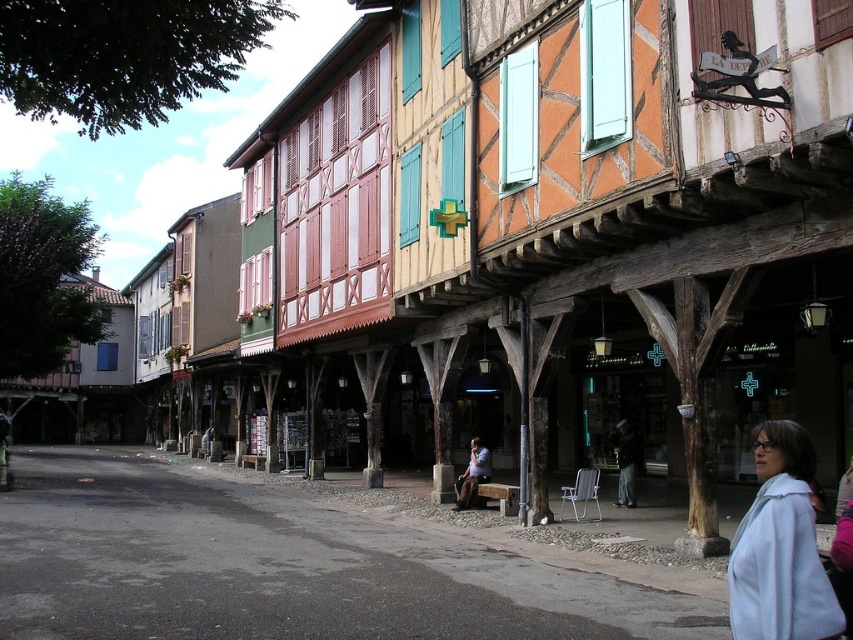
Question: Which point is closer to the camera taking this photo?

Choices:
 (A) (798, 451)
 (B) (618, 490)
 (C) (483, 468)

Answer: (A)

Question: Which of the following is the farthest from the observer?

Choices:
 (A) (624, 456)
 (B) (468, 460)

Answer: (B)

Question: Considering the relative positions of light blue woolen coat at lower right and dark brown leather jacket at center in the image provided, where is light blue woolen coat at lower right located with respect to dark brown leather jacket at center?

Choices:
 (A) left
 (B) right

Answer: (A)

Question: Can you confirm if light blue woolen coat at lower right is thinner than dark brown leather jacket at center?

Choices:
 (A) no
 (B) yes

Answer: (A)

Question: Which point is closer to the camera taking this photo?

Choices:
 (A) (619, 456)
 (B) (793, 576)

Answer: (B)

Question: Is light blue woolen coat at lower right to the left of dark brown leather jacket at center from the viewer's perspective?

Choices:
 (A) yes
 (B) no

Answer: (A)